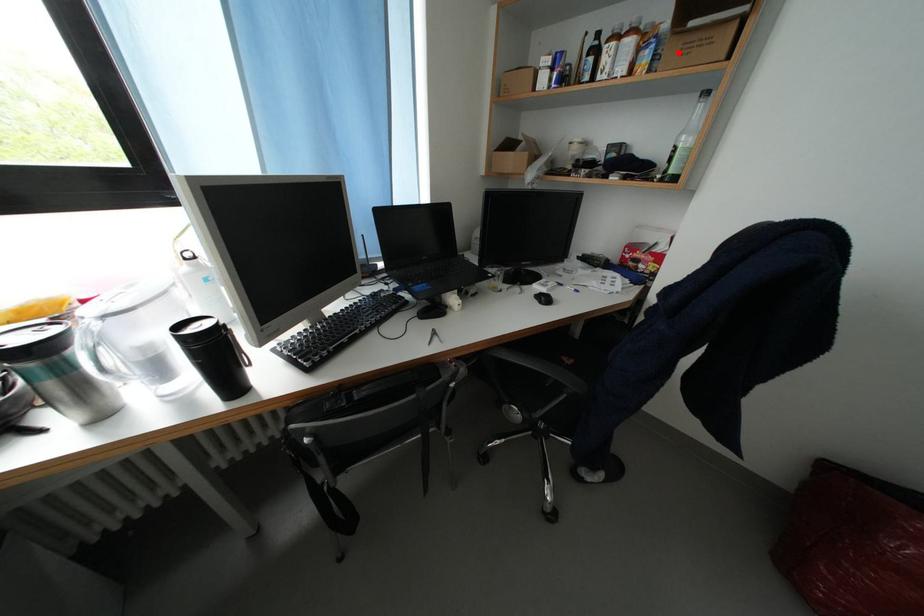
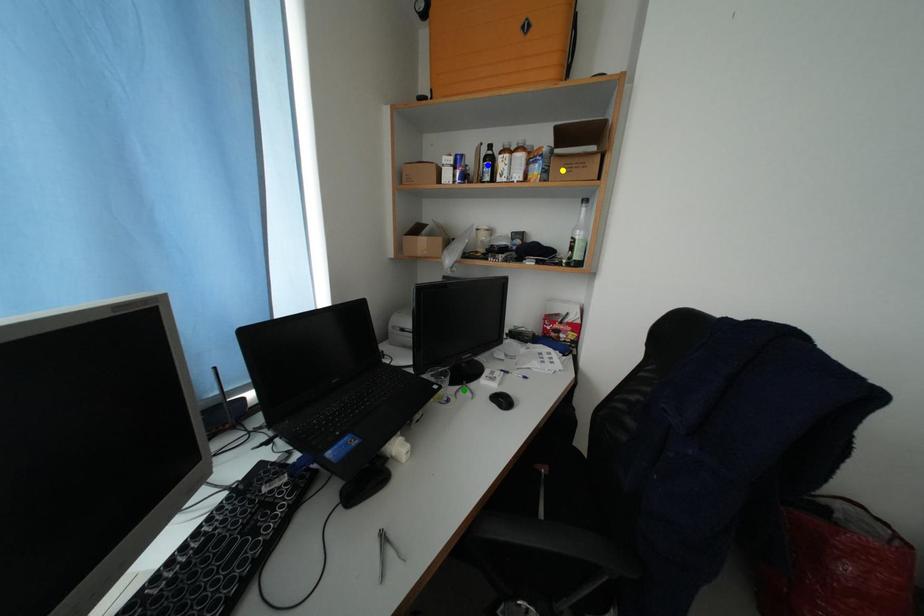
Question: I am providing you with two images of the same scene from different viewpoints. A red point is marked on the first image. You are given multiple points on the second image. Which mark in image 2 goes with the point in image 1?

Choices:
 (A) yellow point
 (B) green point
 (C) blue point

Answer: (A)